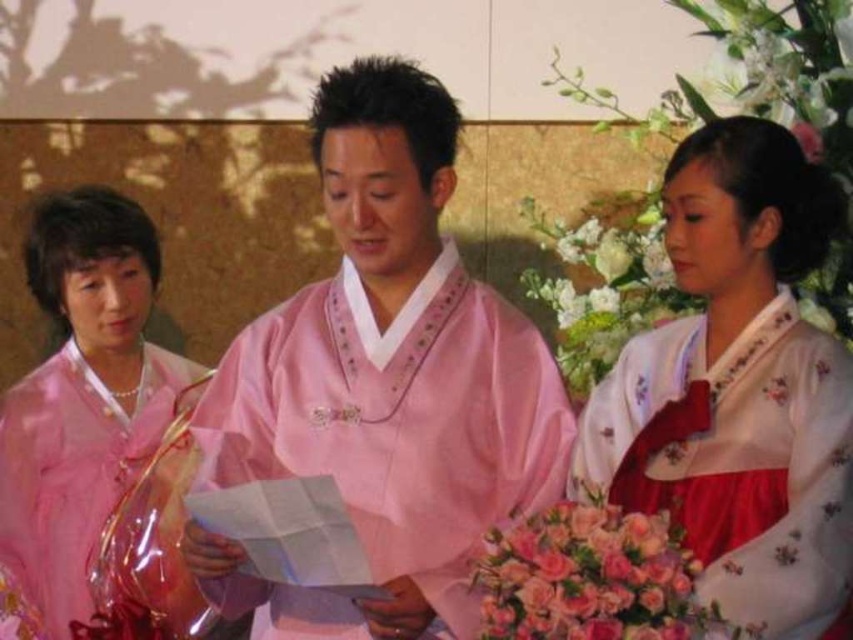
Question: Which point is farther to the camera?

Choices:
 (A) pink floral bouquet at lower right
 (B) pink satin kimono at center

Answer: (B)

Question: Observing the image, what is the correct spatial positioning of pink satin kimono at center in reference to white satin hanbok at right?

Choices:
 (A) above
 (B) below

Answer: (A)

Question: Can you confirm if pink satin kimono at center is positioned below satin pink hanbok at left?

Choices:
 (A) no
 (B) yes

Answer: (A)

Question: Where is pink satin kimono at center located in relation to pink floral bouquet at lower right in the image?

Choices:
 (A) right
 (B) left

Answer: (B)

Question: Estimate the real-world distances between objects in this image. Which object is farther from the satin pink hanbok at left?

Choices:
 (A) pink floral bouquet at lower right
 (B) pink satin kimono at center

Answer: (A)

Question: Which point is closer to the camera taking this photo?

Choices:
 (A) (688, 572)
 (B) (57, 595)
 (C) (459, 605)

Answer: (A)